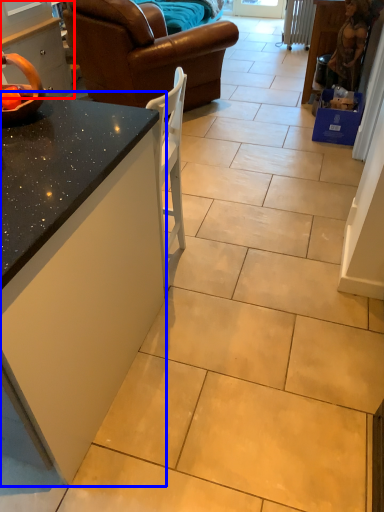
Question: Which point is further to the camera, cabinetry (highlighted by a red box) or countertop (highlighted by a blue box)?

Choices:
 (A) cabinetry
 (B) countertop

Answer: (A)